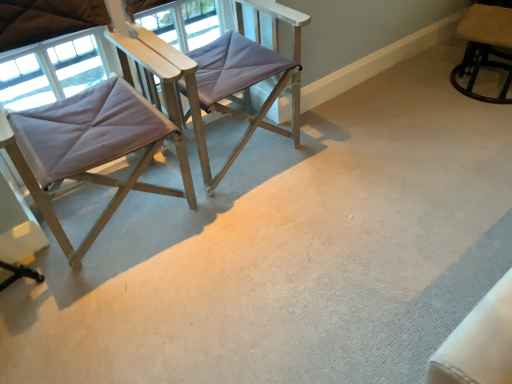
This screenshot has height=384, width=512. Identify the location of vacant space to the right of matte purple fabric chair at center, marked as the 2th chair in a right-to-left arrangement. (353, 155).